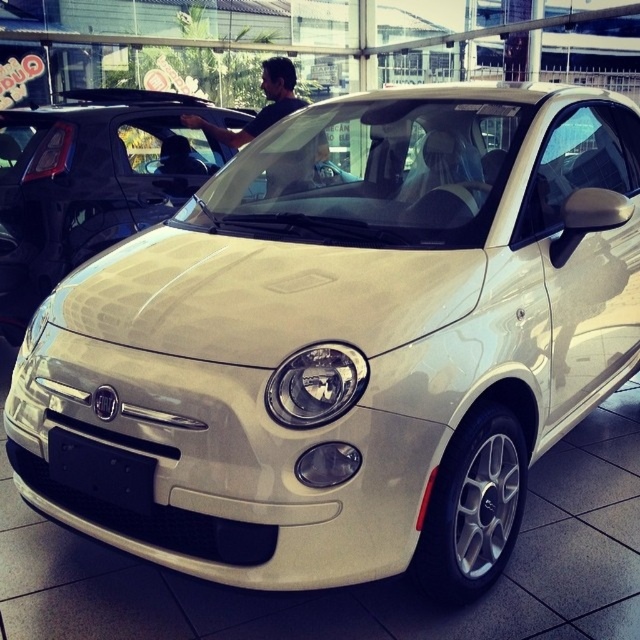
Question: Which point is closer to the camera?

Choices:
 (A) black plastic license plate at front
 (B) dark brown leather jacket at center
 (C) white glossy car at center

Answer: (A)

Question: Is white glossy car at center thinner than black plastic license plate at front?

Choices:
 (A) no
 (B) yes

Answer: (A)

Question: Is black plastic license plate at front in front of dark brown leather jacket at center?

Choices:
 (A) yes
 (B) no

Answer: (A)

Question: Is white glossy car at center thinner than dark brown leather jacket at center?

Choices:
 (A) no
 (B) yes

Answer: (A)

Question: Estimate the real-world distances between objects in this image. Which object is closer to the dark brown leather jacket at center?

Choices:
 (A) white glossy car at center
 (B) black plastic license plate at front

Answer: (A)

Question: Which object appears farthest from the camera in this image?

Choices:
 (A) dark brown leather jacket at center
 (B) white glossy car at center
 (C) black plastic license plate at front

Answer: (A)